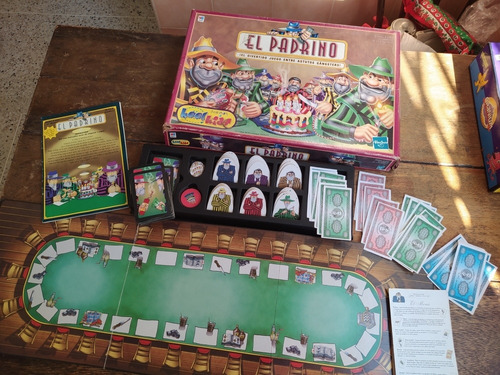
Image resolution: width=500 pixels, height=375 pixels. What are the coordinates of `pile of game cards` in the screenshot? It's located at (149, 192).